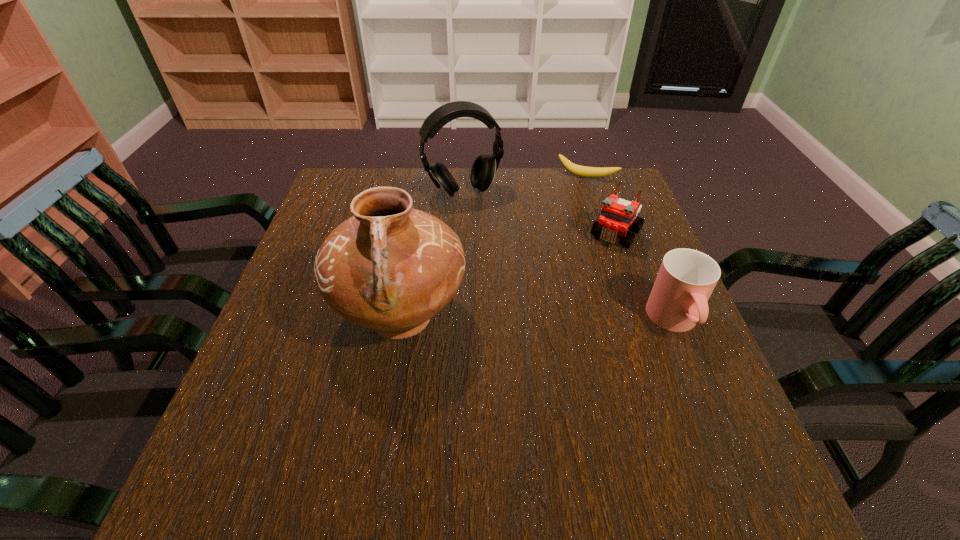
Where is `unoccupied position between the third farthest object and the pottery`? The height and width of the screenshot is (540, 960). unoccupied position between the third farthest object and the pottery is located at coordinates (509, 275).

The image size is (960, 540). I want to click on free space between the cup and the earphone, so click(x=569, y=257).

Find the location of a particular element. The image size is (960, 540). free area in between the Lego and the pottery is located at coordinates (509, 275).

Where is `free spot between the cup and the pottery`? The width and height of the screenshot is (960, 540). free spot between the cup and the pottery is located at coordinates (539, 319).

I want to click on free point between the Lego and the cup, so click(645, 278).

Identify the location of free point between the pottery and the third nearest object. (509, 275).

Where is `free area in between the shortest object and the pottery`? free area in between the shortest object and the pottery is located at coordinates (493, 247).

Identify which object is located as the third nearest to the Lego. Please provide its 2D coordinates. Your answer should be formatted as a tuple, i.e. [(x, y)], where the tuple contains the x and y coordinates of a point satisfying the conditions above.

[(484, 167)]

Image resolution: width=960 pixels, height=540 pixels. In order to click on the closest object relative to the third nearest object in this screenshot , I will do `click(678, 301)`.

Where is `blank space that satisfies the following two spatial constraints: 1. on the front side of the third nearest object; 2. on the right side of the shortest object`? The width and height of the screenshot is (960, 540). blank space that satisfies the following two spatial constraints: 1. on the front side of the third nearest object; 2. on the right side of the shortest object is located at coordinates (604, 233).